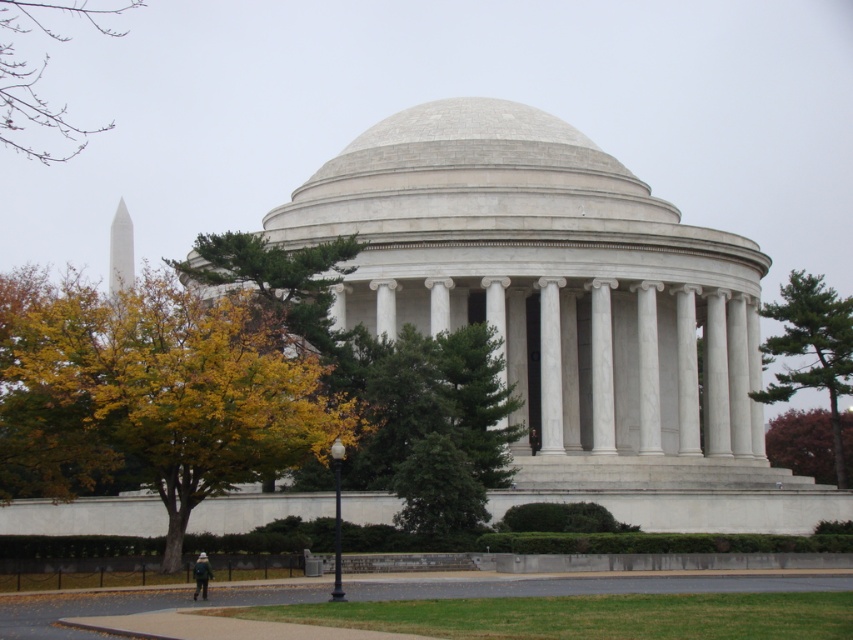
You are standing in front of the neoclassical building and want to take a photo that includes both the green leafy tree at upper left and the white marble pillar at center. Which object should you position closer to the edge of the frame to ensure both are fully visible?

Since the green leafy tree at upper left is taller than the white marble pillar at center, you should position the green leafy tree at upper left closer to the edge of the frame to ensure both are fully visible.

You are standing at the entrance of the neoclassical monument and want to find the green leafy tree at right. Based on the coordinates provided, in which direction should you look to locate it?

The green leafy tree at right is located at point 0.548 on the x axis and 0.953 on the y axis, so you should look towards the upper right direction to locate it.